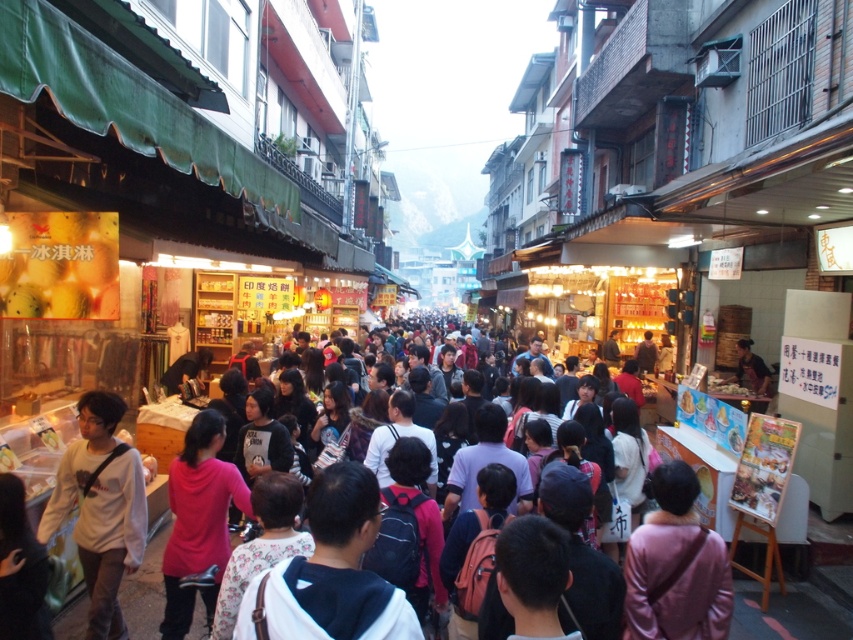
Between white matte sweatshirt at center and dark brown leather jacket at center, which one appears on the left side from the viewer's perspective?

From the viewer's perspective, white matte sweatshirt at center appears more on the left side.

Who is more forward, [83,560] or [756,356]?

Point [83,560] is more forward.

This screenshot has width=853, height=640. I want to click on white matte sweatshirt at center, so click(x=102, y=508).

Can you confirm if white matte sweatshirt at center is bigger than pink fabric bag at center?

Indeed, white matte sweatshirt at center has a larger size compared to pink fabric bag at center.

In the scene shown: Who is more forward, (114, 586) or (718, 545)?

Point (718, 545) is in front.

The height and width of the screenshot is (640, 853). I want to click on white matte sweatshirt at center, so click(102, 508).

Can you confirm if pink fabric bag at center is wider than dark brown leather jacket at center?

Yes.

Is pink fabric bag at center positioned at the back of dark brown leather jacket at center?

No, pink fabric bag at center is closer to the viewer.

You are a GUI agent. You are given a task and a screenshot of the screen. Output one action in this format:
    pyautogui.click(x=<x>, y=<y>)
    Task: Click on the pink fabric bag at center
    
    Given the screenshot: What is the action you would take?
    pyautogui.click(x=676, y=566)

Where is `pink fabric bag at center`? Image resolution: width=853 pixels, height=640 pixels. pink fabric bag at center is located at coordinates (676, 566).